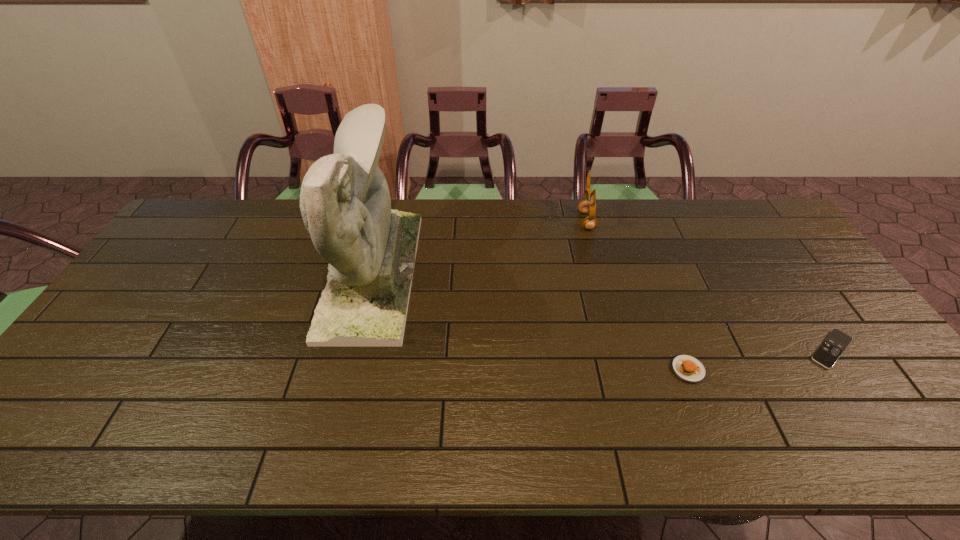
Where is `the tallest object`? the tallest object is located at coordinates point(345,203).

Locate an element on the screen. The width and height of the screenshot is (960, 540). the leftmost object is located at coordinates (345, 203).

At what (x,y) coordinates should I click in order to perform the action: click on the second object from left to right. Please return your answer as a coordinate pair (x, y). Looking at the image, I should click on (585, 206).

This screenshot has height=540, width=960. I want to click on the second tallest object, so click(585, 206).

I want to click on the second object from right to left, so click(688, 368).

Identify the location of food. This screenshot has width=960, height=540. (688, 368).

Image resolution: width=960 pixels, height=540 pixels. In order to click on the rightmost object in this screenshot , I will do `click(834, 345)`.

Locate an element on the screen. This screenshot has height=540, width=960. the shortest object is located at coordinates (834, 345).

In order to click on vacant region located on the base of the leftmost object in this screenshot , I will do `click(475, 273)`.

Locate an element on the screen. vacant space situated 0.210m on the front-facing side of the second tallest object is located at coordinates (517, 221).